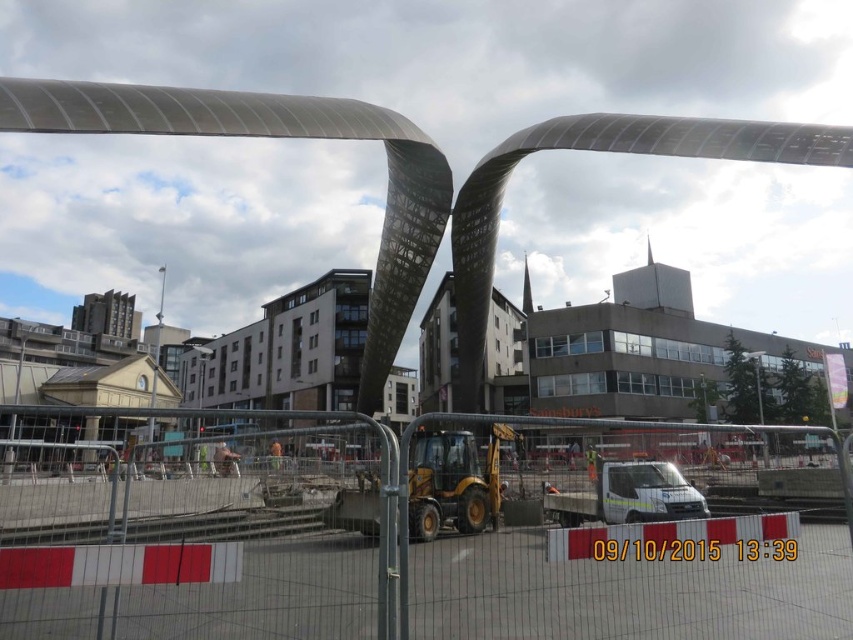
Question: Does white plastic fencing at lower center appear over yellow rubber excavator at center?

Choices:
 (A) yes
 (B) no

Answer: (B)

Question: Does white plastic fencing at lower center appear on the right side of yellow rubber excavator at center?

Choices:
 (A) yes
 (B) no

Answer: (B)

Question: Is white plastic fencing at lower center further to the viewer compared to yellow rubber excavator at center?

Choices:
 (A) yes
 (B) no

Answer: (B)

Question: Which point is closer to the camera?

Choices:
 (A) (256, 435)
 (B) (467, 468)

Answer: (B)